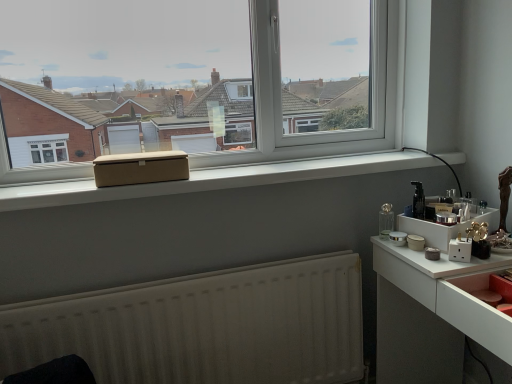
Question: From the image's perspective, is white matte radiator at lower center above or below white glossy counter at right?

Choices:
 (A) above
 (B) below

Answer: (B)

Question: Would you say white matte radiator at lower center is to the left or to the right of white glossy counter at right in the picture?

Choices:
 (A) left
 (B) right

Answer: (A)

Question: Estimate the real-world distances between objects in this image. Which object is farther from the matte pink drawer at lower right?

Choices:
 (A) white plastic tray at right
 (B) white glossy counter at right
 (C) beige fabric box at center
 (D) black glossy bottle at right
 (E) beige matte box at center

Answer: (C)

Question: Which object is the farthest from the white glossy counter at right?

Choices:
 (A) white plastic tray at right
 (B) beige fabric box at center
 (C) white matte radiator at lower center
 (D) matte pink drawer at lower right
 (E) black glossy bottle at right

Answer: (B)